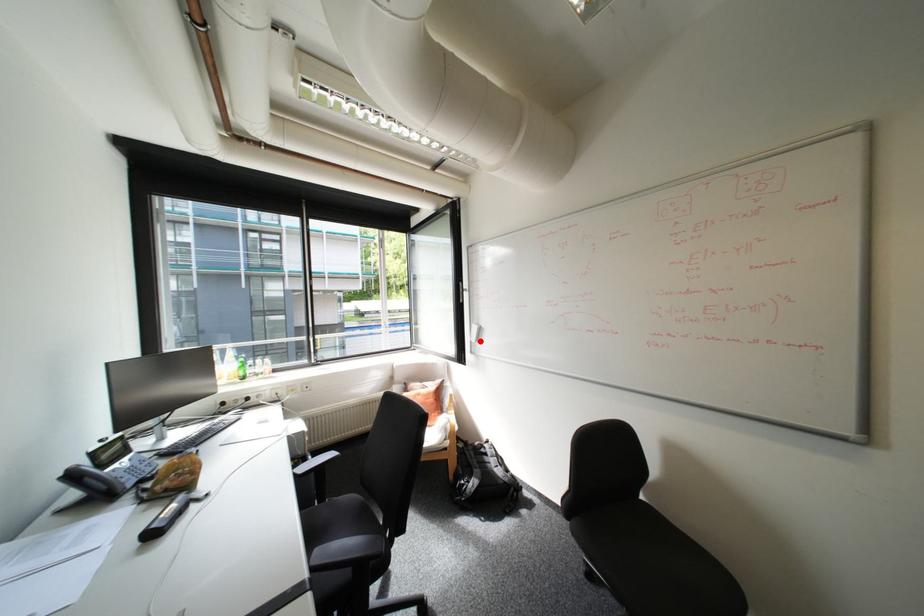
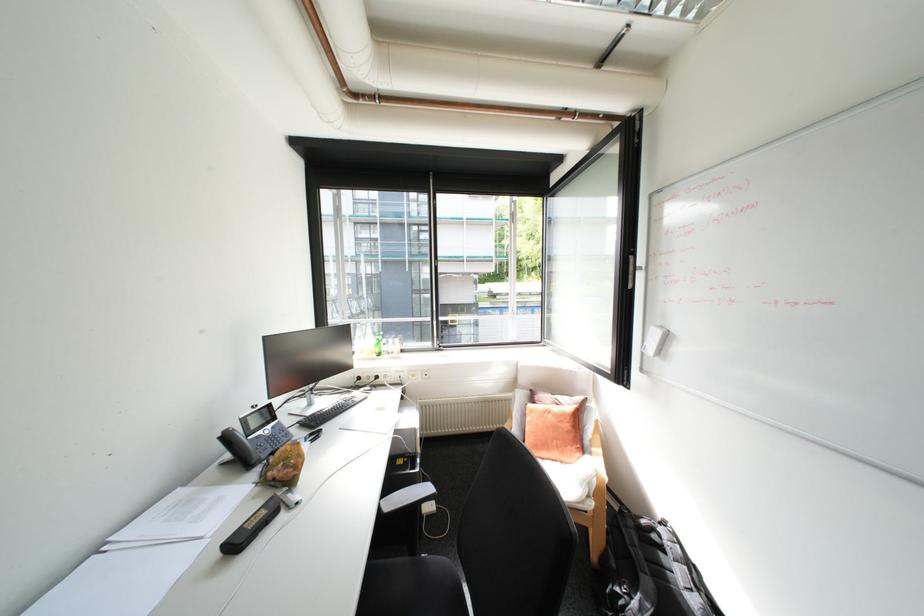
Find the pixel in the second image that matches the highlighted location in the first image.

(652, 353)